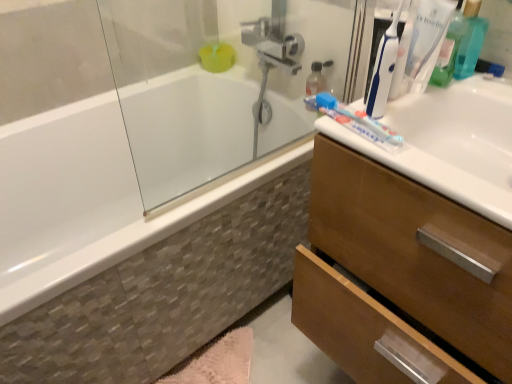
Question: From the image's perspective, would you say translucent plastic toothbrush at upper right, the second toothbrush in the left-to-right sequence, is positioned over white glossy sink at upper right?

Choices:
 (A) yes
 (B) no

Answer: (A)

Question: Is translucent plastic toothbrush at upper right, the second toothbrush in the left-to-right sequence, facing towards white glossy sink at upper right?

Choices:
 (A) no
 (B) yes

Answer: (A)

Question: Is translucent plastic toothbrush at upper right, the first toothbrush viewed from the right, not close to white glossy sink at upper right?

Choices:
 (A) yes
 (B) no

Answer: (B)

Question: Is translucent plastic toothbrush at upper right, the second toothbrush in the left-to-right sequence, behind white glossy sink at upper right?

Choices:
 (A) no
 (B) yes

Answer: (B)

Question: Is translucent plastic toothbrush at upper right, the first toothbrush viewed from the right, touching white glossy sink at upper right?

Choices:
 (A) no
 (B) yes

Answer: (A)

Question: Is translucent plastic toothbrush at upper right, the second toothbrush in the left-to-right sequence, positioned before white glossy sink at upper right?

Choices:
 (A) no
 (B) yes

Answer: (A)

Question: Is translucent plastic toothbrush at upper right, the second toothbrush in the left-to-right sequence, wider than white glossy bathtub at left?

Choices:
 (A) no
 (B) yes

Answer: (A)

Question: Would you say translucent plastic toothbrush at upper right, the first toothbrush viewed from the right, contains white glossy bathtub at left?

Choices:
 (A) yes
 (B) no

Answer: (B)

Question: Can you confirm if translucent plastic toothbrush at upper right, the first toothbrush viewed from the right, is positioned to the right of white glossy bathtub at left?

Choices:
 (A) yes
 (B) no

Answer: (A)

Question: Considering the relative sizes of translucent plastic toothbrush at upper right, the second toothbrush in the left-to-right sequence, and white glossy bathtub at left in the image provided, is translucent plastic toothbrush at upper right, the second toothbrush in the left-to-right sequence, smaller than white glossy bathtub at left?

Choices:
 (A) no
 (B) yes

Answer: (B)

Question: From the image's perspective, is translucent plastic toothbrush at upper right, the second toothbrush in the left-to-right sequence, over white glossy bathtub at left?

Choices:
 (A) yes
 (B) no

Answer: (A)

Question: Is translucent plastic toothbrush at upper right, the second toothbrush in the left-to-right sequence, turned away from white glossy bathtub at left?

Choices:
 (A) yes
 (B) no

Answer: (B)

Question: Is pink fluffy bath mat at lower center to the left of white glossy bathtub at left from the viewer's perspective?

Choices:
 (A) yes
 (B) no

Answer: (B)